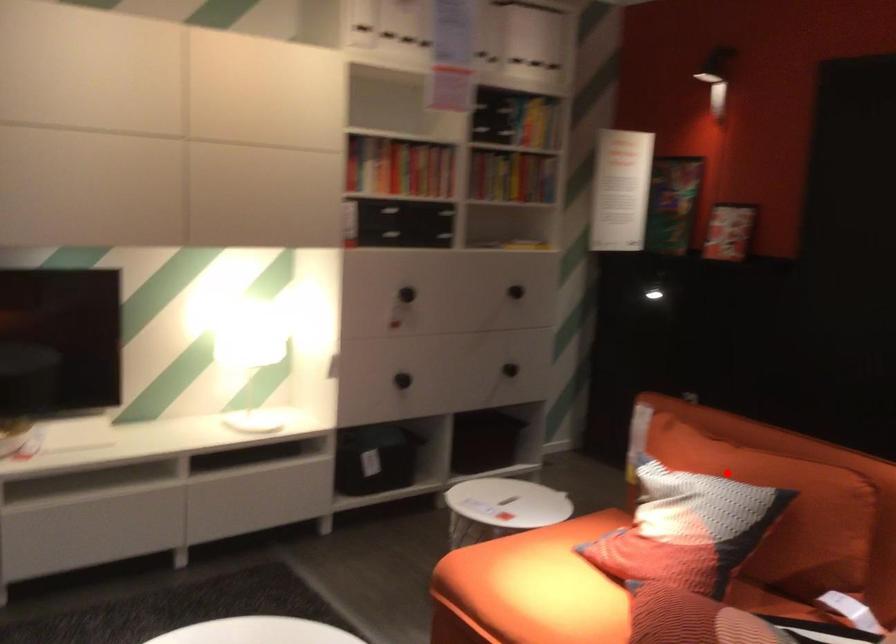
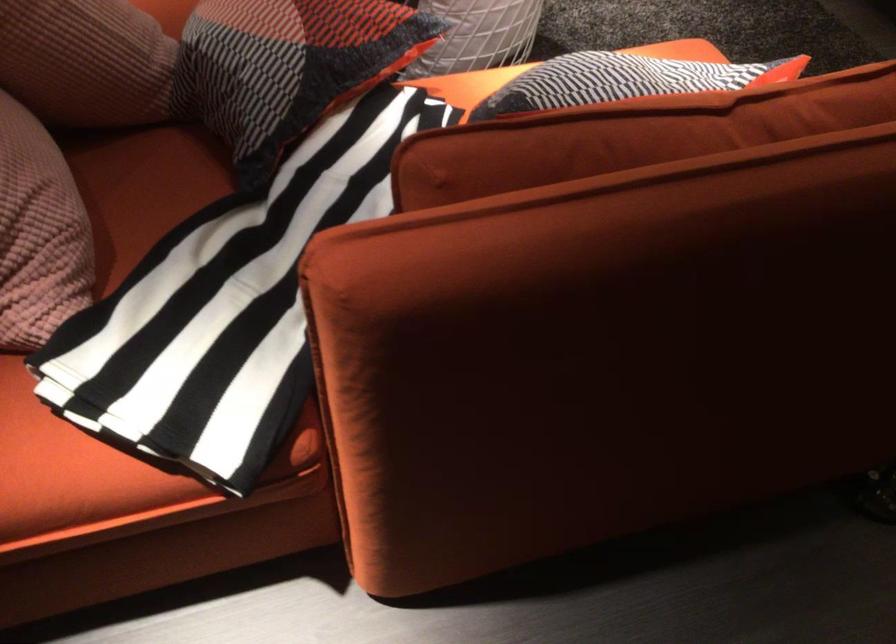
Where in the second image is the point corresponding to the highlighted location from the first image?

(623, 80)